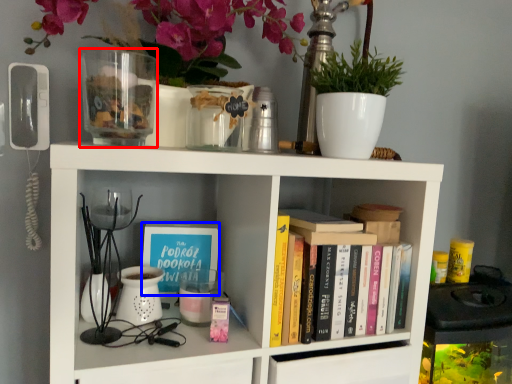
Question: Which object appears farthest to the camera in this image, glass vase (highlighted by a red box) or book cover (highlighted by a blue box)?

Choices:
 (A) glass vase
 (B) book cover

Answer: (B)